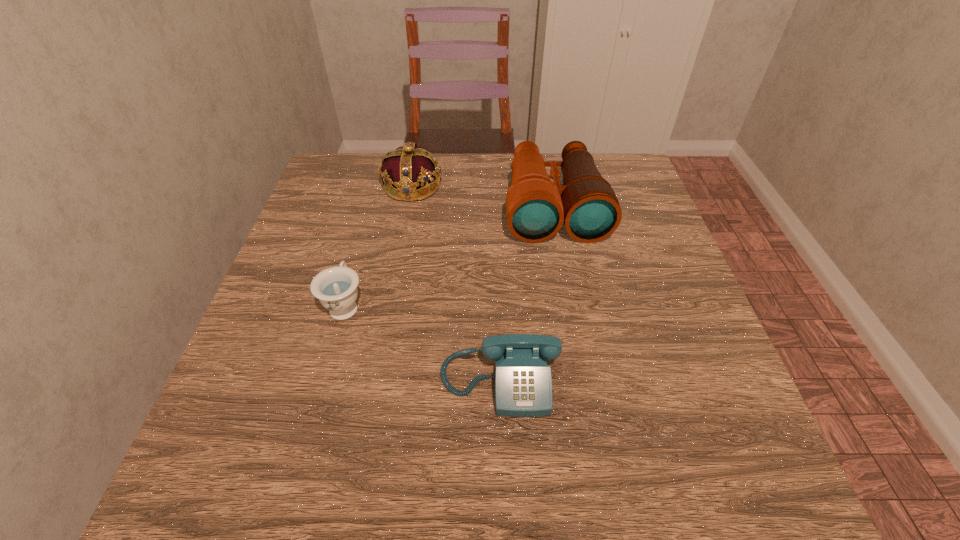
Find the location of a particular element. This screenshot has width=960, height=540. binoculars is located at coordinates (536, 207).

Identify the location of crown. The width and height of the screenshot is (960, 540). (403, 171).

Where is `the third farthest object`? The image size is (960, 540). the third farthest object is located at coordinates (336, 287).

The image size is (960, 540). Find the location of `the nearest object`. the nearest object is located at coordinates (523, 382).

The image size is (960, 540). Identify the location of free region located 0.270m through the lenses of the binoculars. (579, 341).

The image size is (960, 540). I want to click on free spot located 0.090m on the front of the crown, so click(403, 230).

Image resolution: width=960 pixels, height=540 pixels. Find the location of `vacant space located on the side of the second nearest object with the handle`. vacant space located on the side of the second nearest object with the handle is located at coordinates (374, 198).

In order to click on free space located on the side of the second nearest object with the handle in this screenshot , I will do `click(380, 180)`.

The image size is (960, 540). What are the coordinates of `vacant space located 0.290m on the side of the second nearest object with the handle` in the screenshot? It's located at (374, 200).

The image size is (960, 540). What are the coordinates of `free location located 0.100m on the dial of the nearest object` in the screenshot? It's located at (504, 483).